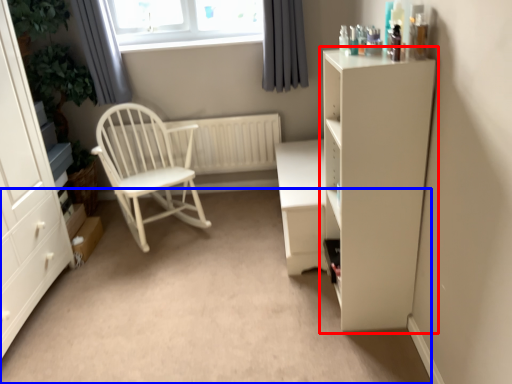
Question: Among these objects, which one is farthest to the camera, cupboard (highlighted by a red box) or plain (highlighted by a blue box)?

Choices:
 (A) cupboard
 (B) plain

Answer: (B)